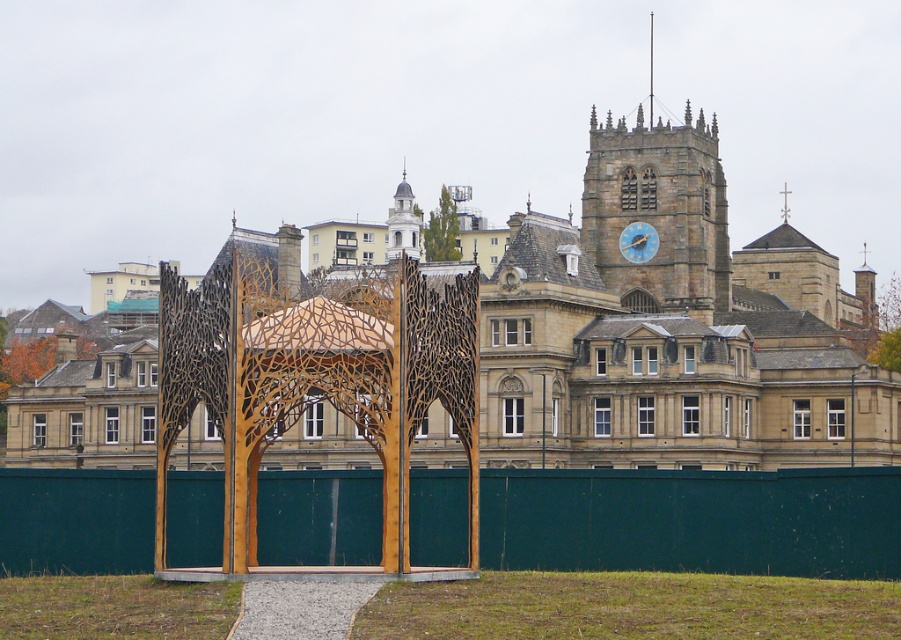
You are standing in front of the sculpture and the historic building. You notice two points marked in the image at coordinates point (899, 380) and point (397, 204). Which of these points is nearer to your current position?

Point (899, 380) is closer to the camera than point (397, 204), so the point (899, 380) is nearer to your current position.